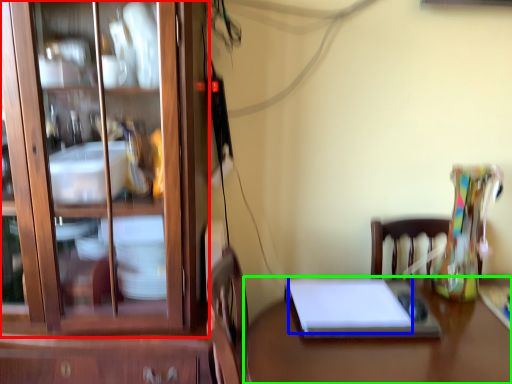
Question: Which object is the farthest from cabinetry (highlighted by a red box)? Choose among these: notebook (highlighted by a blue box) or desk (highlighted by a green box).

Choices:
 (A) notebook
 (B) desk

Answer: (B)